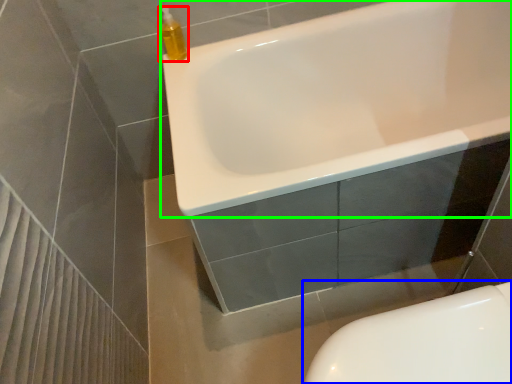
Question: Which object is positioned closest to cleaning product (highlighted by a red box)? Select from toilet (highlighted by a blue box) and bathtub (highlighted by a green box).

Choices:
 (A) toilet
 (B) bathtub

Answer: (B)